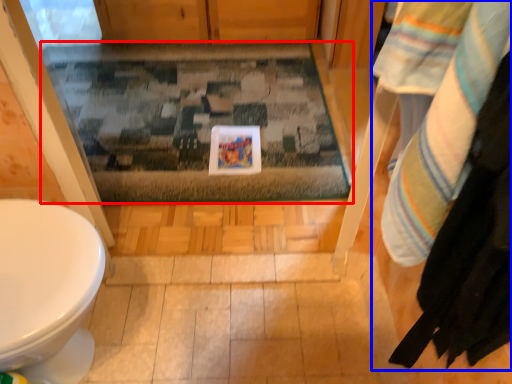
Question: Which object appears closest to the camera in this image, bath mat (highlighted by a red box) or laundry (highlighted by a blue box)?

Choices:
 (A) bath mat
 (B) laundry

Answer: (B)